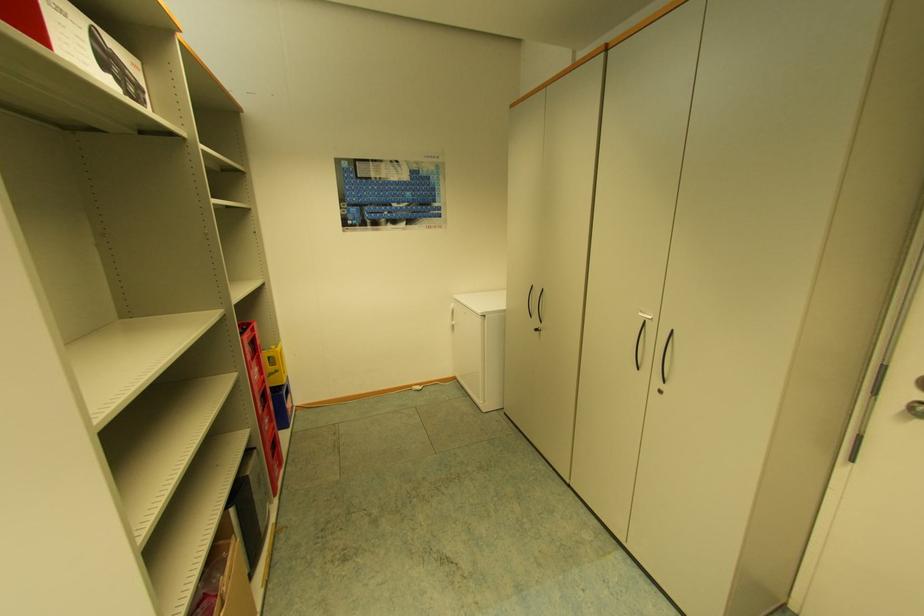
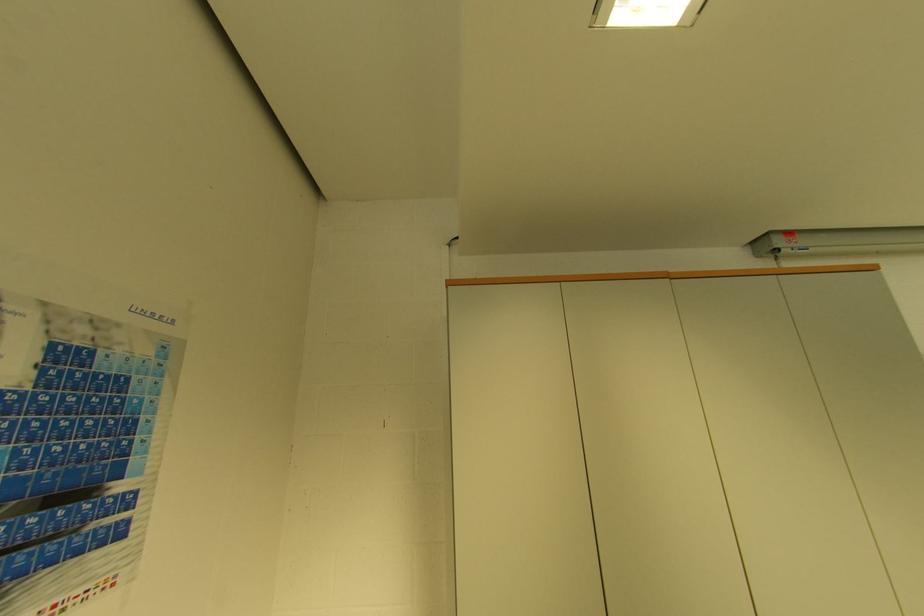
Locate, in the second image, the point that corresponds to (x=444, y=216) in the first image.

(123, 533)